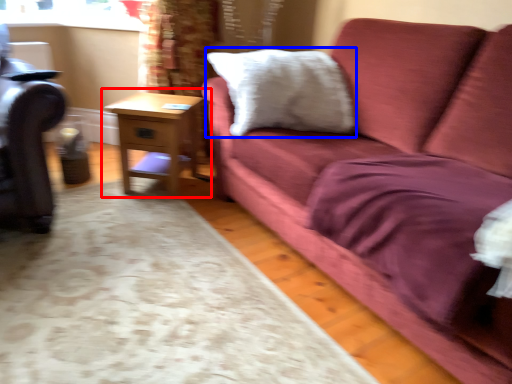
Question: Which of the following is the closest to the observer, table (highlighted by a red box) or pillow (highlighted by a blue box)?

Choices:
 (A) table
 (B) pillow

Answer: (B)